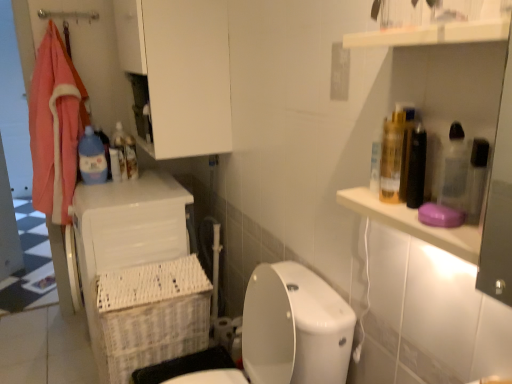
Locate an element on the screen. free space in front of blue plastic bottle at upper left is located at coordinates (117, 181).